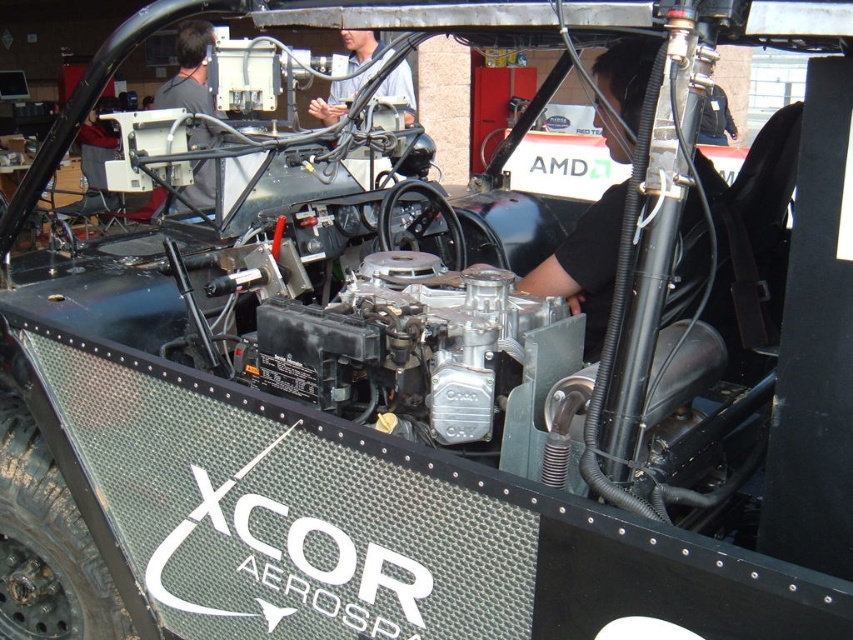
Question: Is black matte shirt at center above black matte computer at upper left?

Choices:
 (A) no
 (B) yes

Answer: (A)

Question: Does black matte computer at upper left appear under light blue shirt at upper center?

Choices:
 (A) no
 (B) yes

Answer: (B)

Question: Which point is farther to the camera?

Choices:
 (A) black matte computer at upper left
 (B) black matte shirt at center

Answer: (A)

Question: Which of the following is the closest to the observer?

Choices:
 (A) (703, 250)
 (B) (200, 131)
 (C) (393, 92)

Answer: (A)

Question: Among these points, which one is nearest to the camera?

Choices:
 (A) (407, 72)
 (B) (165, 100)
 (C) (592, 275)

Answer: (C)

Question: Is black matte shirt at center bigger than black matte computer at upper left?

Choices:
 (A) yes
 (B) no

Answer: (A)